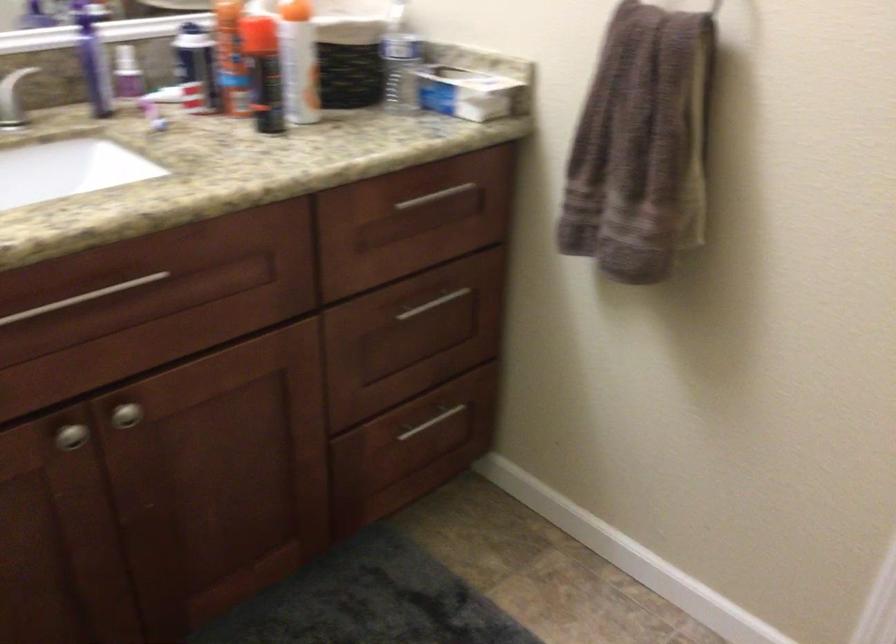
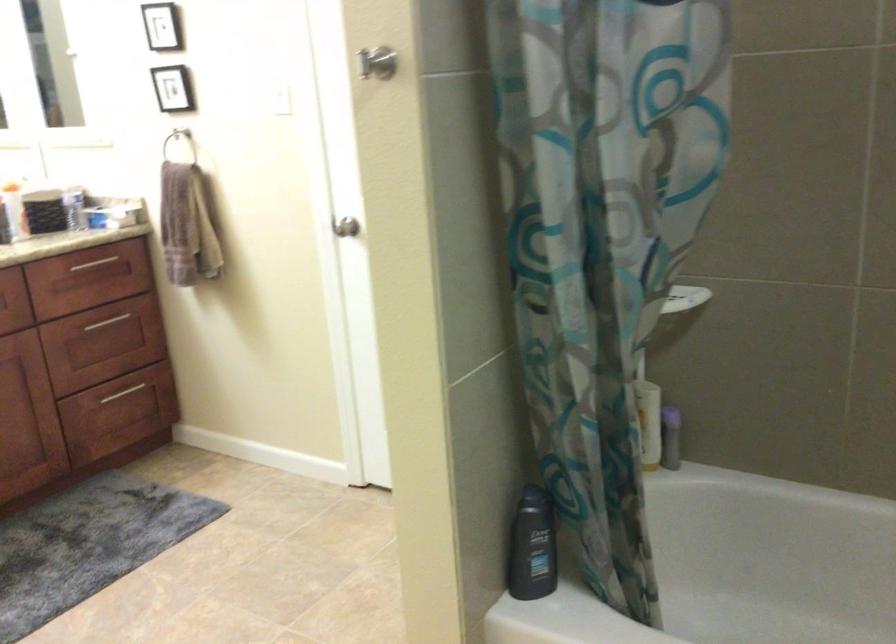
Find the pixel in the second image that matches [435,313] in the first image.

(115, 323)